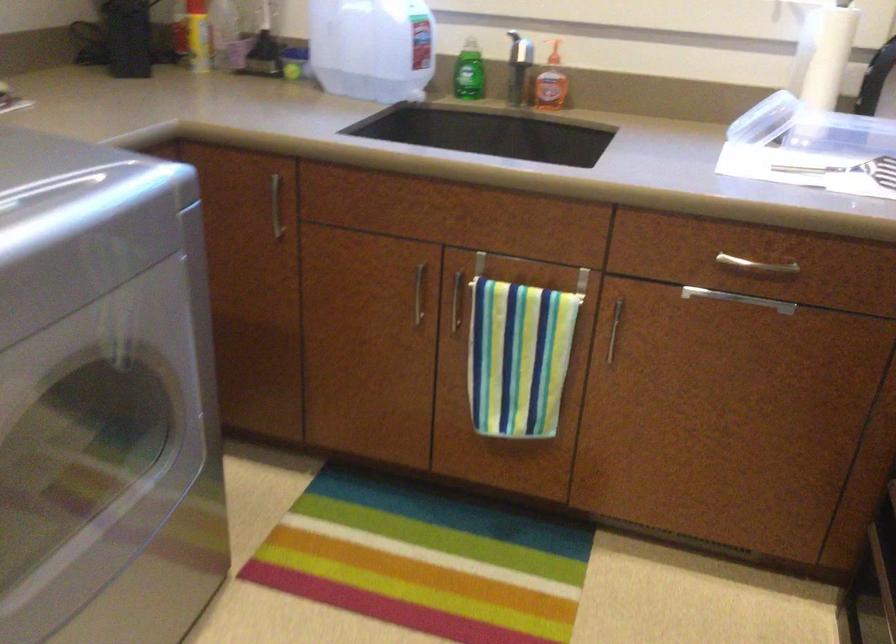
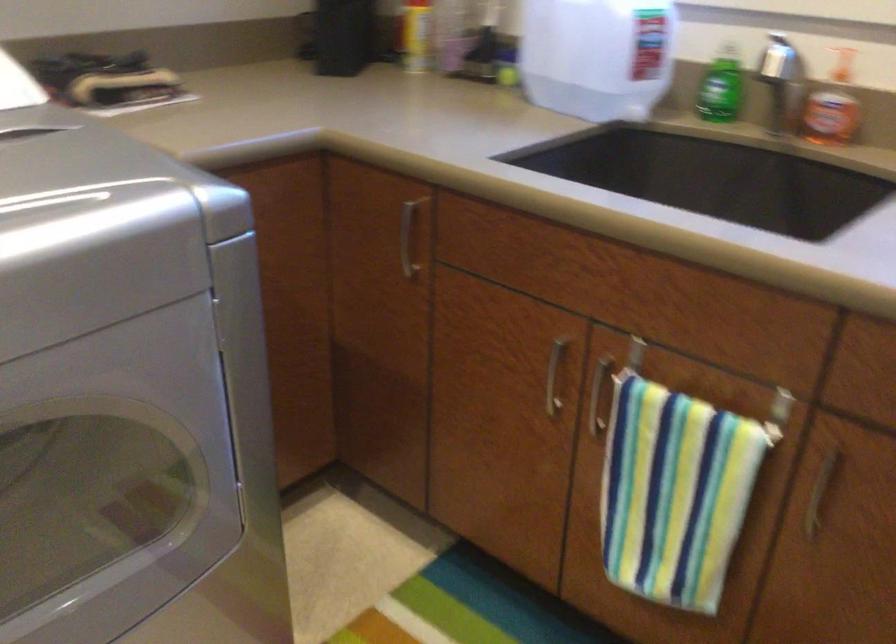
Where in the second image is the point corresponding to (x=469, y=84) from the first image?

(718, 105)